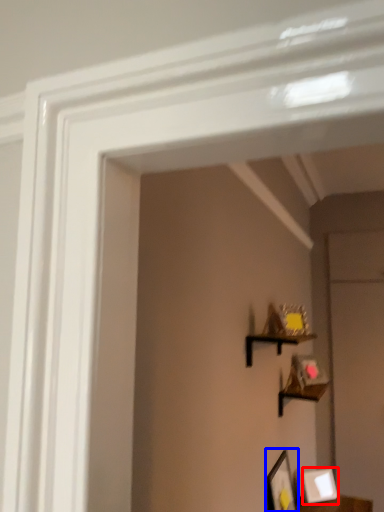
Question: Which object appears farthest to the camera in this image, picture frame (highlighted by a red box) or picture frame (highlighted by a blue box)?

Choices:
 (A) picture frame
 (B) picture frame

Answer: (A)